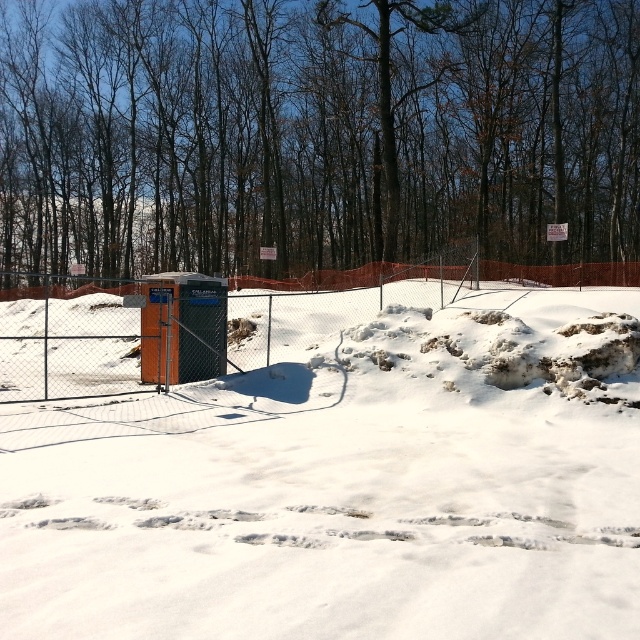
In the scene shown: Between white powdery snow at center and metal chain-link fence at center, which one is positioned higher?

metal chain-link fence at center

Locate an element on the screen. Image resolution: width=640 pixels, height=640 pixels. white powdery snow at center is located at coordinates (346, 486).

Does white powdery snow at center have a greater height compared to brown bark tree at center?

No.

Who is more forward, [67,582] or [308,32]?

Positioned in front is point [67,582].

You are a GUI agent. You are given a task and a screenshot of the screen. Output one action in this format:
    pyautogui.click(x=<x>, y=<y>)
    Task: Click on the white powdery snow at center
    This screenshot has width=640, height=640.
    Given the screenshot: What is the action you would take?
    pyautogui.click(x=346, y=486)

Between point (67, 33) and point (164, 326), which one is positioned in front?

Point (164, 326) is in front.

Does brown bark tree at center have a lesser height compared to metal chain-link fence at center?

No, brown bark tree at center is not shorter than metal chain-link fence at center.

Is point (637, 131) more distant than point (234, 344)?

Yes, point (637, 131) is farther from viewer.

Identify the location of brown bark tree at center. (316, 132).